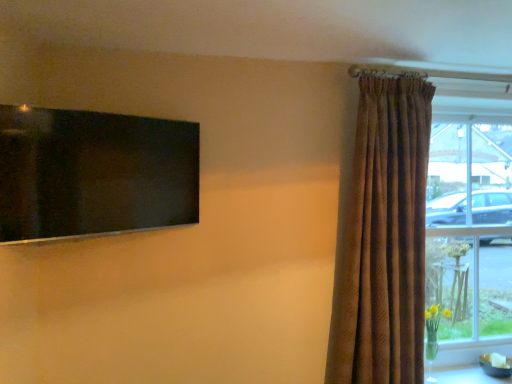
In order to face brown textured curtain at right, should I rotate leftwards or rightwards?

Turn right by 17.478 degrees to look at brown textured curtain at right.

You are a GUI agent. You are given a task and a screenshot of the screen. Output one action in this format:
    pyautogui.click(x=<x>, y=<y>)
    Task: Click on the clear glass window at right
    The image size is (512, 384).
    Given the screenshot: What is the action you would take?
    (471, 230)

Who is bigger, brown textured curtain at right or white glossy table at lower right?

With larger size is brown textured curtain at right.

Is brown textured curtain at right taller than white glossy table at lower right?

Yes.

Based on their positions, is brown textured curtain at right located to the left or right of white glossy table at lower right?

Based on their positions, brown textured curtain at right is located to the left of white glossy table at lower right.

Could you tell me if brown textured curtain at right is turned towards white glossy table at lower right?

No, brown textured curtain at right is not turned towards white glossy table at lower right.

Considering the relative sizes of white glossy table at lower right and black glossy screen at upper left in the image provided, is white glossy table at lower right taller than black glossy screen at upper left?

Incorrect, the height of white glossy table at lower right is not larger of that of black glossy screen at upper left.

Does white glossy table at lower right have a greater width compared to black glossy screen at upper left?

Yes.

Considering the points (486, 382) and (79, 135), which point is in front, point (486, 382) or point (79, 135)?

The point (79, 135) is closer to the camera.

Is white glossy table at lower right aimed at black glossy screen at upper left?

No, white glossy table at lower right is not aimed at black glossy screen at upper left.

Does point (480, 279) lie behind point (426, 141)?

Yes, point (480, 279) is farther from viewer.

Is clear glass window at right directly adjacent to brown textured curtain at right?

clear glass window at right and brown textured curtain at right are clearly separated.

Can you confirm if clear glass window at right is positioned to the left of brown textured curtain at right?

No.

Which object is further away from the camera taking this photo, clear glass window at right or brown textured curtain at right?

clear glass window at right is further from the camera.

From the image's perspective, is brown textured curtain at right on clear glass window at right?

Yes, from the image's perspective, brown textured curtain at right is on top of clear glass window at right.

Are brown textured curtain at right and clear glass window at right located far from each other?

No, brown textured curtain at right is in close proximity to clear glass window at right.

Can you tell me how much brown textured curtain at right and clear glass window at right differ in facing direction?

3.55 degrees separate the facing orientations of brown textured curtain at right and clear glass window at right.

Is clear glass window at right surrounded by brown textured curtain at right?

No.

From the image's perspective, is white glossy table at lower right above or below clear glass window at right?

From the image's perspective, white glossy table at lower right appears below clear glass window at right.

Between white glossy table at lower right and clear glass window at right, which one has more height?

clear glass window at right is taller.

Is the surface of white glossy table at lower right in direct contact with clear glass window at right?

No, white glossy table at lower right is not beside clear glass window at right.

Is white glossy table at lower right not within clear glass window at right?

white glossy table at lower right lies outside clear glass window at right's area.

Is brown textured curtain at right with black glossy screen at upper left?

No.

From the image's perspective, between brown textured curtain at right and black glossy screen at upper left, which one is located above?

black glossy screen at upper left, from the image's perspective.

In the scene shown: Which of these two, brown textured curtain at right or black glossy screen at upper left, is wider?

Wider between the two is brown textured curtain at right.

In terms of size, does brown textured curtain at right appear bigger or smaller than black glossy screen at upper left?

Clearly, brown textured curtain at right is larger in size than black glossy screen at upper left.

Who is taller, black glossy screen at upper left or brown textured curtain at right?

With more height is brown textured curtain at right.

Does black glossy screen at upper left have a lesser width compared to brown textured curtain at right?

Yes.

Is black glossy screen at upper left bigger or smaller than brown textured curtain at right?

In the image, black glossy screen at upper left appears to be smaller than brown textured curtain at right.

From the picture: Is brown textured curtain at right completely or partially inside black glossy screen at upper left?

Actually, brown textured curtain at right is outside black glossy screen at upper left.

Identify the location of curtain that is on the left side of white glossy table at lower right. (383, 238).

Where is `table directly beneath the black glossy screen at upper left (from a real-world perspective)`? The image size is (512, 384). table directly beneath the black glossy screen at upper left (from a real-world perspective) is located at coordinates (468, 376).

Based on their spatial positions, is white glossy table at lower right or clear glass window at right further from brown textured curtain at right?

white glossy table at lower right is further to brown textured curtain at right.

Which object lies nearer to the anchor point clear glass window at right, brown textured curtain at right or white glossy table at lower right?

white glossy table at lower right.

Based on their spatial positions, is clear glass window at right or white glossy table at lower right closer to black glossy screen at upper left?

Based on the image, clear glass window at right appears to be nearer to black glossy screen at upper left.

Consider the image. Based on their spatial positions, is clear glass window at right or white glossy table at lower right closer to brown textured curtain at right?

clear glass window at right is positioned closer to the anchor brown textured curtain at right.

Which object lies further to the anchor point brown textured curtain at right, white glossy table at lower right or black glossy screen at upper left?

black glossy screen at upper left is further to brown textured curtain at right.

From the image, which object appears to be nearer to clear glass window at right, black glossy screen at upper left or brown textured curtain at right?

brown textured curtain at right is closer to clear glass window at right.

Based on their spatial positions, is brown textured curtain at right or black glossy screen at upper left further from white glossy table at lower right?

black glossy screen at upper left.

Based on their spatial positions, is white glossy table at lower right or brown textured curtain at right closer to black glossy screen at upper left?

brown textured curtain at right lies closer to black glossy screen at upper left than the other object.

Identify the location of curtain between black glossy screen at upper left and clear glass window at right from left to right. This screenshot has width=512, height=384. (383, 238).

Where is `curtain located between black glossy screen at upper left and white glossy table at lower right in the left-right direction`? The width and height of the screenshot is (512, 384). curtain located between black glossy screen at upper left and white glossy table at lower right in the left-right direction is located at coordinates (383, 238).

This screenshot has height=384, width=512. Identify the location of table located between black glossy screen at upper left and clear glass window at right in the left-right direction. (468, 376).

Locate an element on the screen. The image size is (512, 384). window between brown textured curtain at right and white glossy table at lower right in the up-down direction is located at coordinates (471, 230).